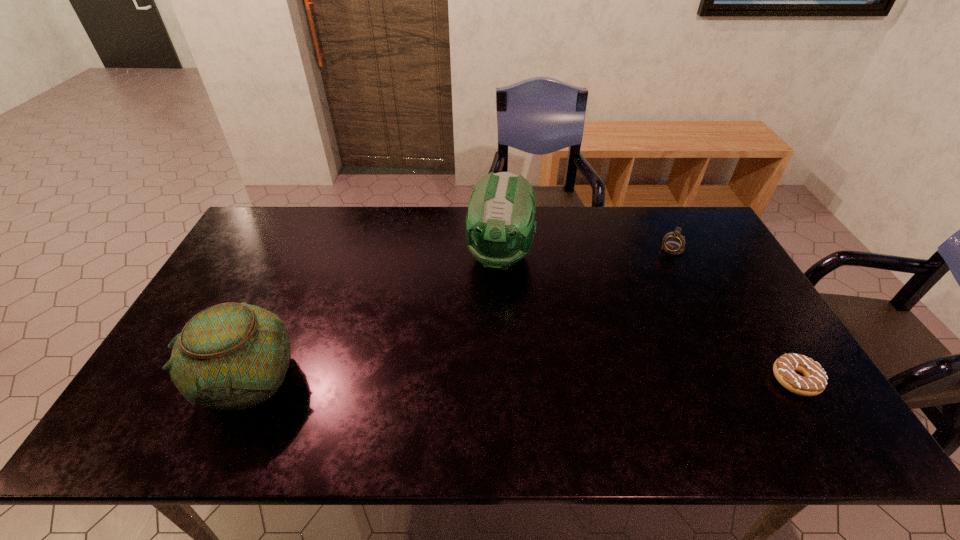
At what (x,y) coordinates should I click in order to perform the action: click on free spot on the desktop that is between the pottery and the rightmost object and is positioned on the face of the third tallest object. Please return your answer as a coordinate pair (x, y). The height and width of the screenshot is (540, 960). Looking at the image, I should click on (592, 379).

Find the location of `free spot on the desktop that is between the pottery and the rightmost object and is positioned on the visor of the second object from left to right`. free spot on the desktop that is between the pottery and the rightmost object and is positioned on the visor of the second object from left to right is located at coordinates [472, 379].